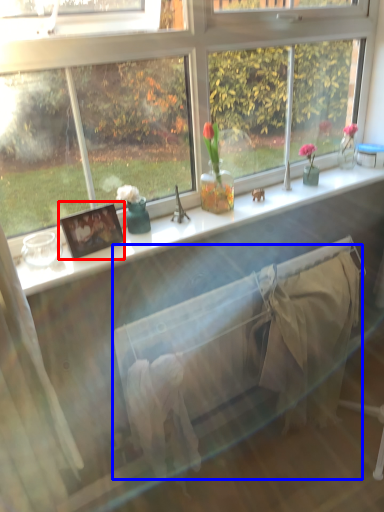
Question: Which point is further to the camera, picture frame (highlighted by a red box) or bed frame (highlighted by a blue box)?

Choices:
 (A) picture frame
 (B) bed frame

Answer: (B)